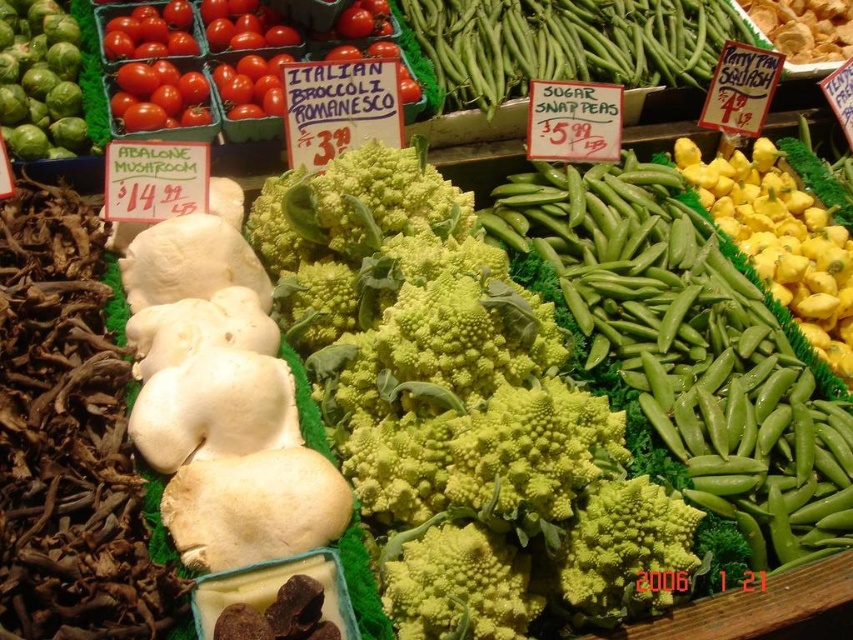
Can you confirm if green smooth sugar snap peas at center is positioned to the right of green snap peas at center?

Yes, green smooth sugar snap peas at center is to the right of green snap peas at center.

Does green smooth sugar snap peas at center appear on the left side of green snap peas at center?

Incorrect, green smooth sugar snap peas at center is not on the left side of green snap peas at center.

Which is behind, point (848, 499) or point (669, 8)?

The point (669, 8) is behind.

The width and height of the screenshot is (853, 640). In order to click on green smooth sugar snap peas at center in this screenshot , I will do `click(691, 348)`.

Is yellow-green smooth squash at right to the left of green matte brussels sprouts at left from the viewer's perspective?

No, yellow-green smooth squash at right is not to the left of green matte brussels sprouts at left.

Who is more forward, [849,289] or [0,60]?

Positioned in front is point [849,289].

Identify the location of yellow-green smooth squash at right. The height and width of the screenshot is (640, 853). (781, 241).

What do you see at coordinates (457, 401) in the screenshot? The image size is (853, 640). I see `green rough broccoli at center` at bounding box center [457, 401].

Between green rough broccoli at center and yellow-green smooth squash at right, which one appears on the left side from the viewer's perspective?

From the viewer's perspective, green rough broccoli at center appears more on the left side.

Does point (577, 529) come farther from viewer compared to point (785, 228)?

No.

The image size is (853, 640). In order to click on green rough broccoli at center in this screenshot , I will do `click(457, 401)`.